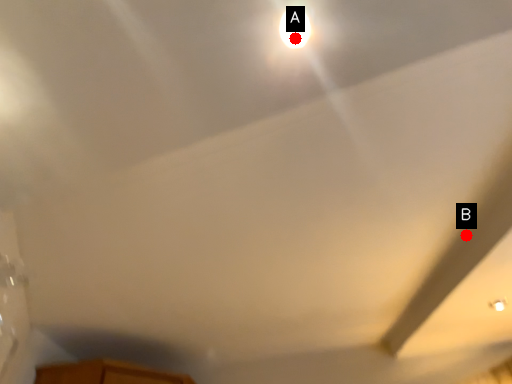
Question: Two points are circled on the image, labeled by A and B beside each circle. Which of the following is the farthest from the observer?

Choices:
 (A) A is further
 (B) B is further

Answer: (B)